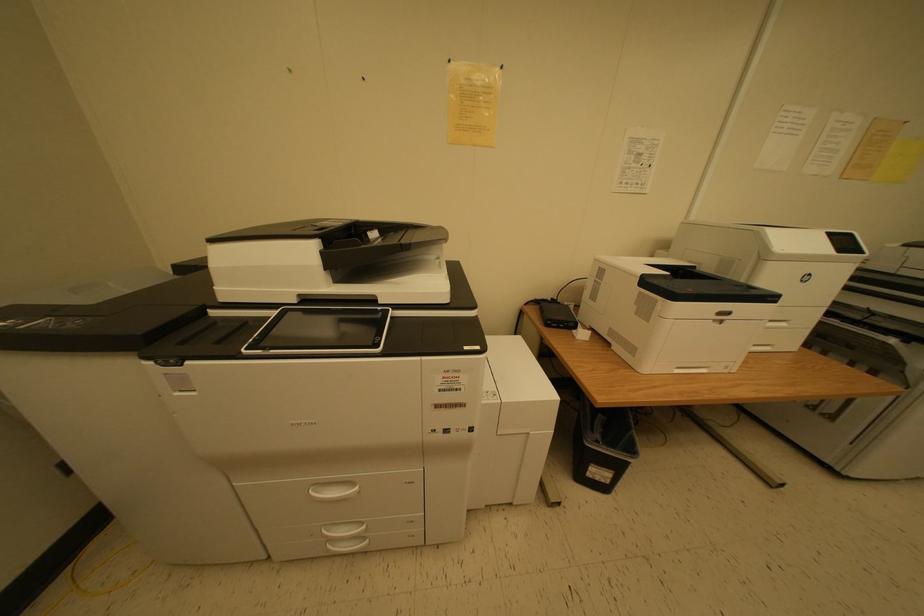
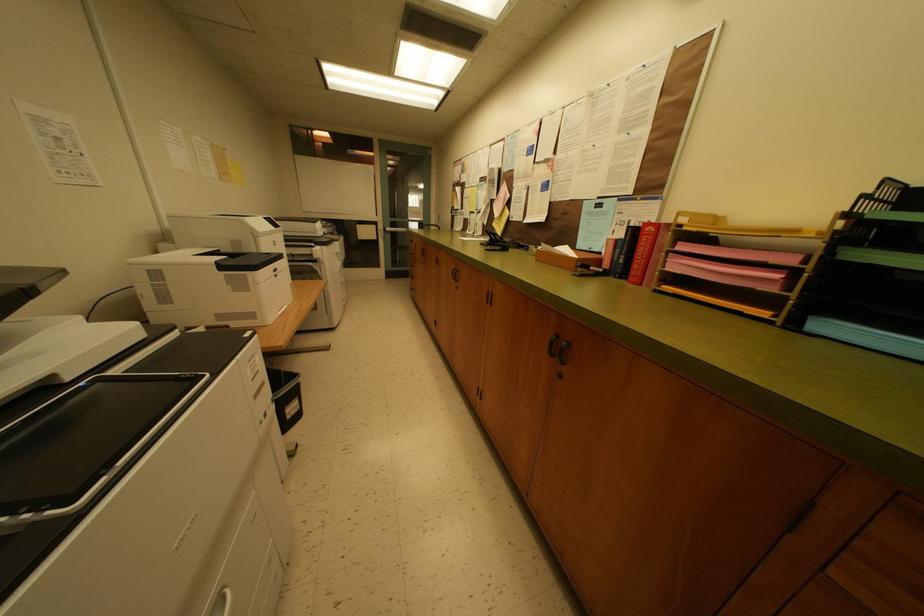
The images are taken continuously from a first-person perspective. In which direction is your viewpoint rotating?

The camera's rotation is toward right-down.